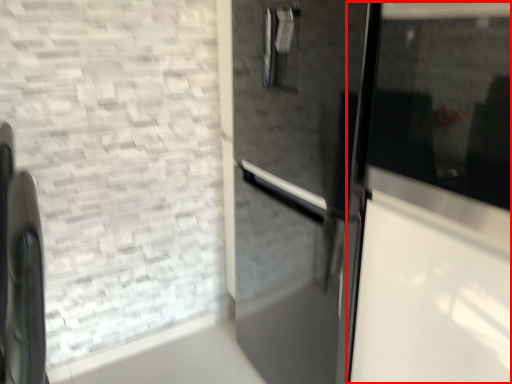
Question: From the image's perspective, where is glass door (annotated by the red box) located relative to appliance?

Choices:
 (A) above
 (B) below

Answer: (A)